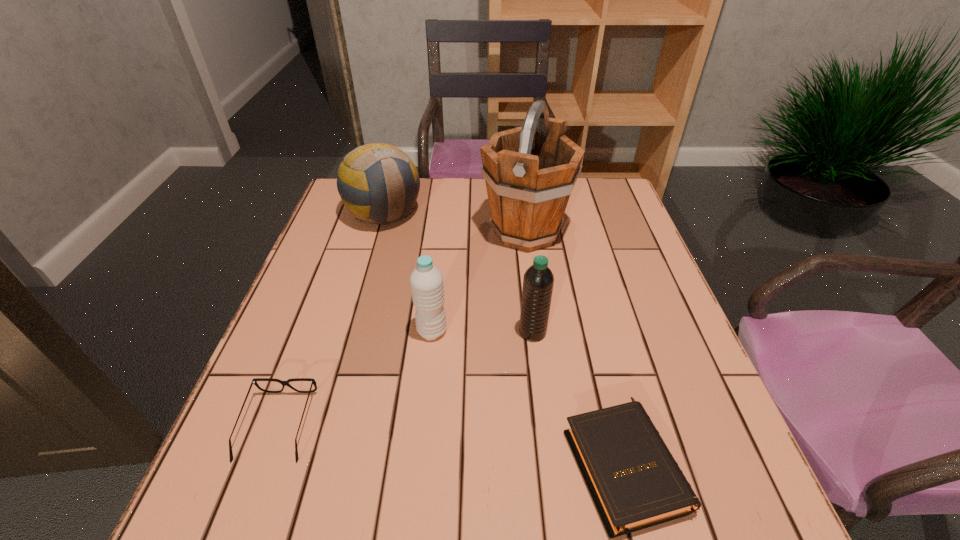
I want to click on free area in between the volleyball and the tallest object, so click(x=455, y=222).

In order to click on vacant area that lies between the fourth object from right to left and the spectacles in this screenshot , I will do `click(355, 378)`.

I want to click on vacant area that lies between the right water bottle and the spectacles, so click(405, 379).

At what (x,y) coordinates should I click in order to perform the action: click on vacant area that lies between the volleyball and the Bible. Please return your answer as a coordinate pair (x, y). The height and width of the screenshot is (540, 960). Looking at the image, I should click on (504, 339).

Find the location of `object that can be found as the third closest to the volleyball`. object that can be found as the third closest to the volleyball is located at coordinates (538, 280).

Locate which object ranks in proximity to the fourth object from right to left. Please provide its 2D coordinates. Your answer should be formatted as a tuple, i.e. [(x, y)], where the tuple contains the x and y coordinates of a point satisfying the conditions above.

[(538, 280)]

Find the location of a particular element. free location that satisfies the following two spatial constraints: 1. on the front side of the bucket; 2. on the right side of the volleyball is located at coordinates (379, 232).

This screenshot has width=960, height=540. Identify the location of free spot that satisfies the following two spatial constraints: 1. on the front side of the volleyball; 2. on the left side of the fourth object from right to left. (350, 331).

The width and height of the screenshot is (960, 540). What are the coordinates of `vacant space that satisfies the following two spatial constraints: 1. with the lenses facing outward on the spectacles; 2. on the right side of the Bible` in the screenshot? It's located at (264, 464).

The width and height of the screenshot is (960, 540). I want to click on free location that satisfies the following two spatial constraints: 1. on the back side of the third object from left to right; 2. on the left side of the tallest object, so click(443, 232).